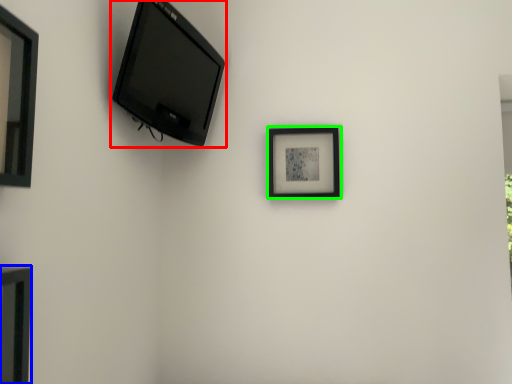
Question: Considering the real-world distances, which object is farthest from television (highlighted by a red box)? picture frame (highlighted by a blue box) or picture frame (highlighted by a green box)?

Choices:
 (A) picture frame
 (B) picture frame

Answer: (A)